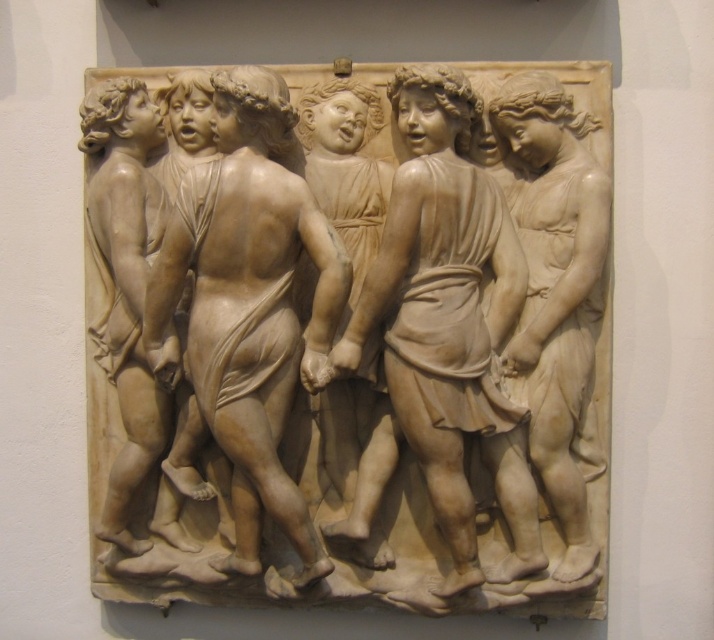
Is point (338, 140) closer to viewer compared to point (331, 323)?

No, (338, 140) is further to viewer.

Can you confirm if white marble relief at center is positioned to the right of smooth beige statue at center?

Yes, white marble relief at center is to the right of smooth beige statue at center.

Locate an element on the screen. The image size is (714, 640). white marble relief at center is located at coordinates [346, 337].

Which of these two, matte white marble cherub at center or smooth beige cherub at left, stands shorter?

smooth beige cherub at left is shorter.

Can you confirm if matte white marble cherub at center is positioned above smooth beige cherub at left?

No, matte white marble cherub at center is not above smooth beige cherub at left.

The height and width of the screenshot is (640, 714). What do you see at coordinates (448, 320) in the screenshot?
I see `matte white marble cherub at center` at bounding box center [448, 320].

This screenshot has height=640, width=714. In order to click on matte white marble cherub at center in this screenshot , I will do tap(448, 320).

Between matte white marble cherub at center and white marble cherub at right, which one has more height?

matte white marble cherub at center is taller.

Which is behind, point (453, 218) or point (531, 339)?

The point (531, 339) is more distant.

Image resolution: width=714 pixels, height=640 pixels. What are the coordinates of `matte white marble cherub at center` in the screenshot? It's located at (448, 320).